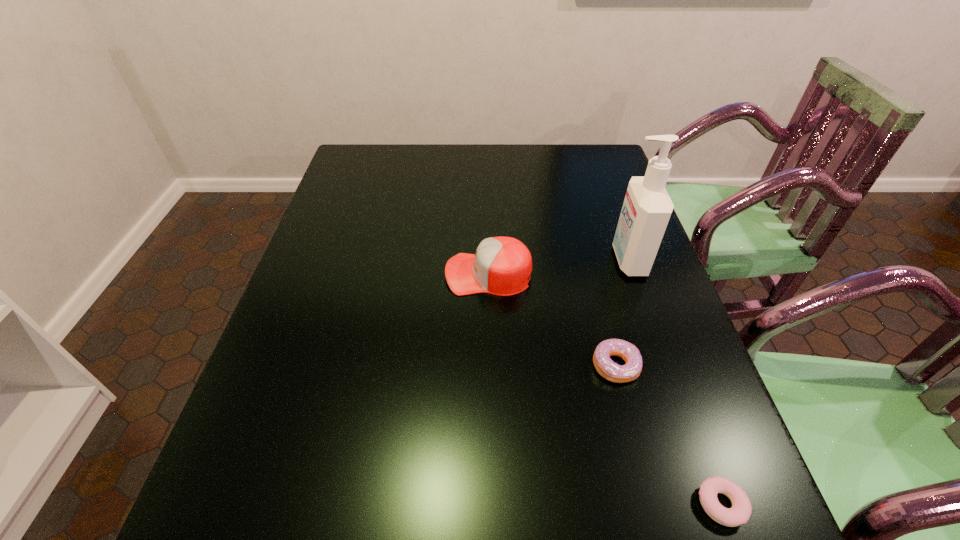
In order to click on the tallest object in this screenshot , I will do `click(647, 207)`.

In order to click on the second tallest object in this screenshot , I will do `click(501, 266)`.

Locate an element on the screen. baseball cap is located at coordinates (501, 266).

This screenshot has height=540, width=960. Identify the location of the third farthest object. (608, 369).

Image resolution: width=960 pixels, height=540 pixels. What are the coordinates of `the second shortest object` in the screenshot? It's located at (608, 369).

Find the location of a particular element. the nearer doughnut is located at coordinates (739, 513).

Locate an element on the screen. the shorter doughnut is located at coordinates (739, 513).

The image size is (960, 540). Identify the location of vacant region located 0.240m on the front label of the cleansing agent. (520, 260).

Where is `free space located on the front label of the cleansing agent`? free space located on the front label of the cleansing agent is located at coordinates (498, 260).

Image resolution: width=960 pixels, height=540 pixels. Find the location of `vacant region located 0.310m on the front label of the cleansing agent`. vacant region located 0.310m on the front label of the cleansing agent is located at coordinates (494, 260).